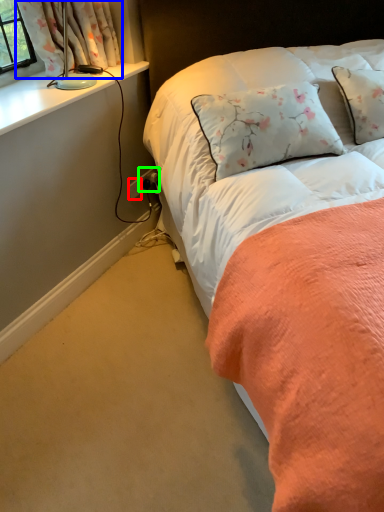
Question: Considering the real-world distances, which object is closest to power outlet (highlighted by a red box)? curtain (highlighted by a blue box) or electric outlet (highlighted by a green box).

Choices:
 (A) curtain
 (B) electric outlet

Answer: (B)